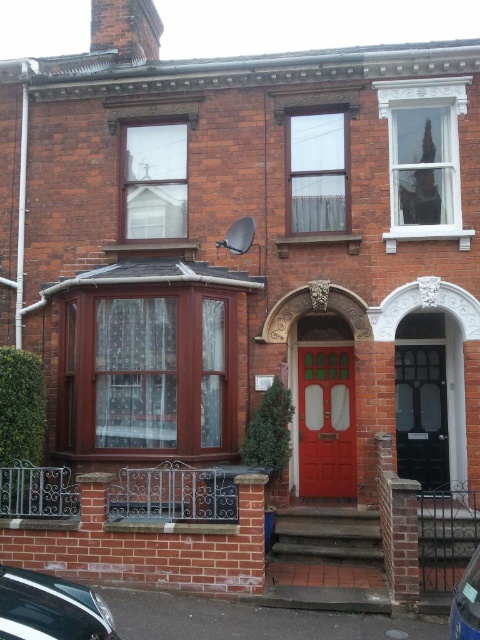
You are standing in front of the traditional brick terraced house. There is a point marked at coordinates (421, 413). What object is located at that point?

The point at coordinates (421, 413) corresponds to the black textured door at center.

You are a delivery person trying to park your van between the shiny black car at lower left and the blue metallic car at lower right. Can you fit your van if it requires 2 meters of space?

The shiny black car at lower left is positioned over blue metallic car at lower right, so there is no space between them. Your van cannot fit.

You are a delivery person approaching the house and need to locate the entrance. Based on the image, which object is higher up relative to the other? The black textured door at center or the shiny black car at lower left?

The black textured door at center is positioned over the shiny black car at lower left, so the door is higher up than the car.